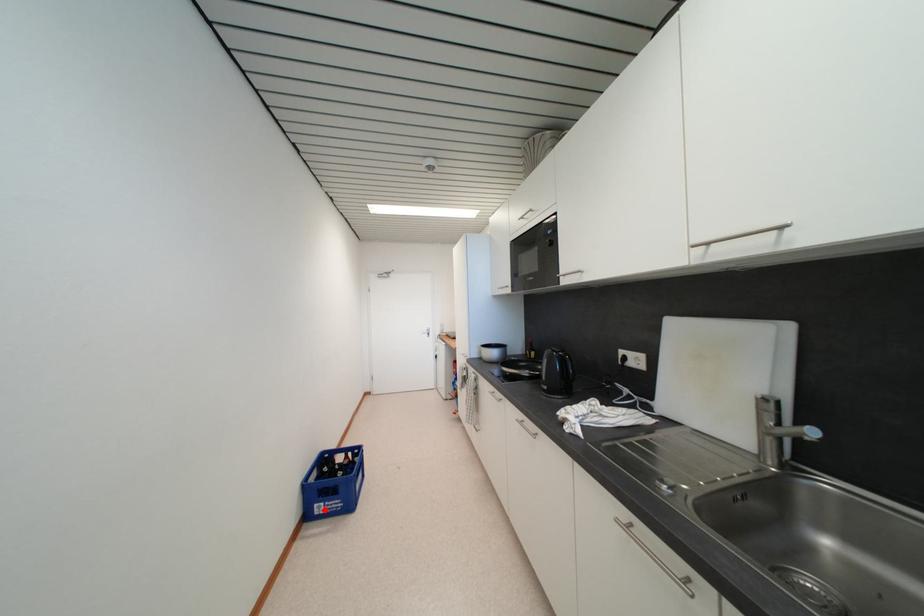
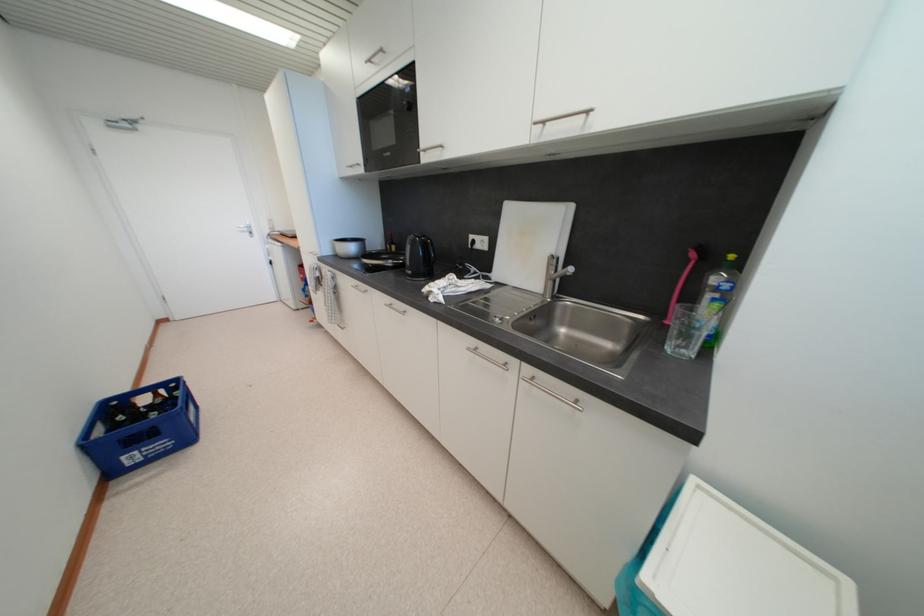
The point at the highlighted location is marked in the first image. Where is the corresponding point in the second image?

(138, 460)